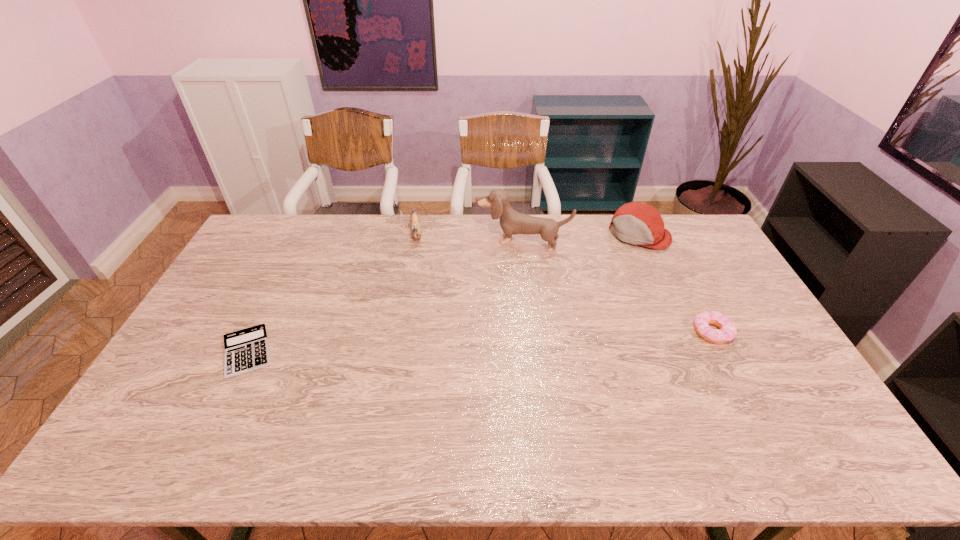
Find the location of a particular element. the leftmost object is located at coordinates (246, 350).

Find the location of a particular element. This screenshot has height=540, width=960. the shortest object is located at coordinates (246, 350).

In order to click on the fourth tallest object in this screenshot , I will do `click(727, 331)`.

What are the coordinates of `the tallest object` in the screenshot? It's located at (512, 222).

The image size is (960, 540). I want to click on puppy, so click(512, 222).

At what (x,y) coordinates should I click in order to perform the action: click on cap. Please return your answer as a coordinate pair (x, y). Image resolution: width=960 pixels, height=540 pixels. Looking at the image, I should click on (636, 223).

Where is `the fourth object from right to left`? the fourth object from right to left is located at coordinates pos(414,219).

Find the location of a particular element. The height and width of the screenshot is (540, 960). vacant space located on the back of the leftmost object is located at coordinates pos(277,292).

The image size is (960, 540). Find the location of `free location located 0.070m on the right of the fourth tallest object`. free location located 0.070m on the right of the fourth tallest object is located at coordinates pyautogui.click(x=755, y=332).

Find the location of a particular element. This screenshot has width=960, height=540. free space located 0.240m at the face of the third object from right to left is located at coordinates (493, 296).